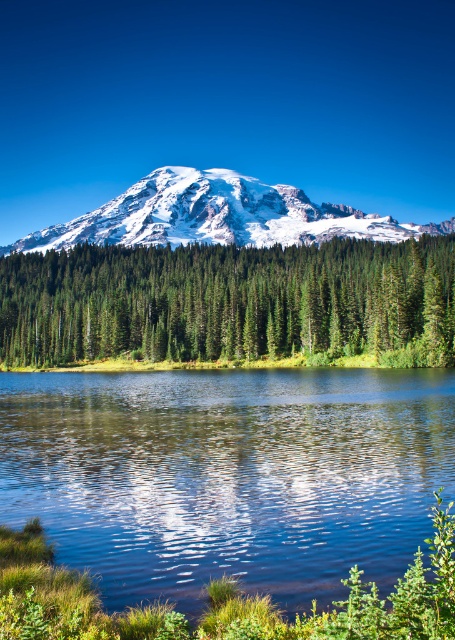
Describe the element at coordinates (227, 301) in the screenshot. The width and height of the screenshot is (455, 640). I see `green matte tree at center` at that location.

Between green matte tree at center and snowy white mountain at upper center, which one is positioned lower?

green matte tree at center is lower down.

Consider the image. Who is more distant from viewer, (281, 284) or (50, 225)?

Positioned behind is point (50, 225).

I want to click on green matte tree at center, so click(227, 301).

Is clear water at center thinner than snowy white mountain at upper center?

Yes.

Can you confirm if clear water at center is positioned to the left of snowy white mountain at upper center?

Yes, clear water at center is to the left of snowy white mountain at upper center.

Identify the location of clear water at center. This screenshot has height=640, width=455. (228, 476).

Can you confirm if clear water at center is smaller than green matte tree at center?

Correct, clear water at center occupies less space than green matte tree at center.

Is the position of clear water at center less distant than that of green matte tree at center?

Yes, clear water at center is in front of green matte tree at center.

Between point (293, 424) and point (106, 278), which one is positioned behind?

Positioned behind is point (106, 278).

This screenshot has height=640, width=455. I want to click on clear water at center, so 228,476.